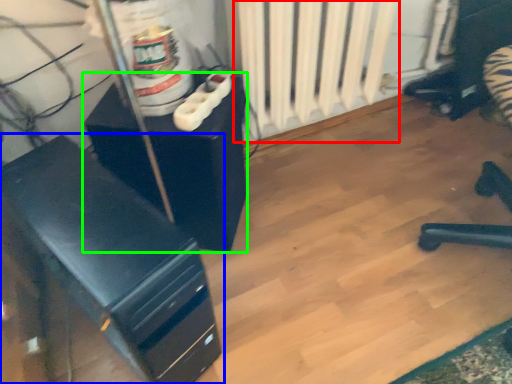
Question: Considering the real-world distances, which object is closest to radiator (highlighted by a red box)? furniture (highlighted by a blue box) or furniture (highlighted by a green box).

Choices:
 (A) furniture
 (B) furniture

Answer: (B)